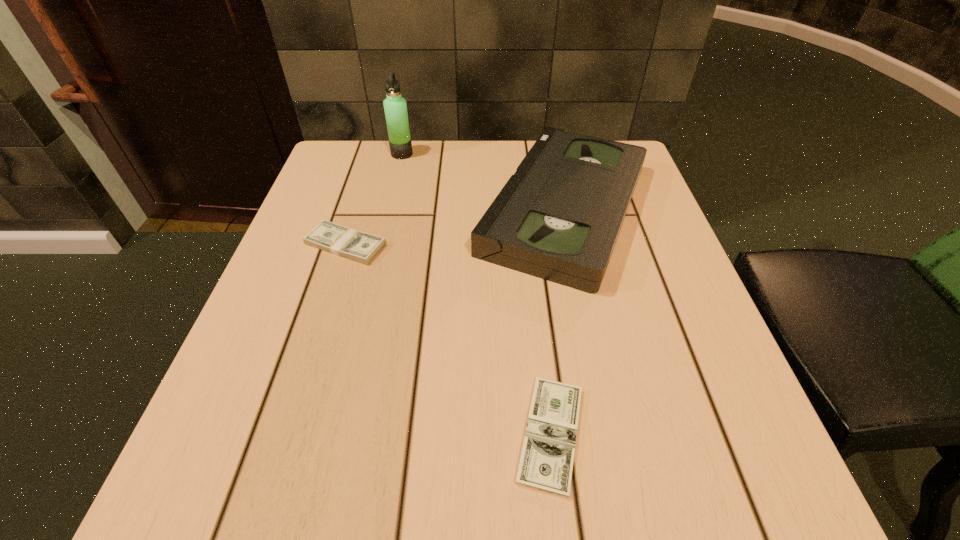
The width and height of the screenshot is (960, 540). In order to click on free spot between the shortest object and the thermos bottle in this screenshot , I will do `click(476, 294)`.

The width and height of the screenshot is (960, 540). In order to click on object that is the third closest to the left dollar in this screenshot , I will do `click(546, 463)`.

Point out which object is positioned as the third nearest to the left dollar. Please provide its 2D coordinates. Your answer should be formatted as a tuple, i.e. [(x, y)], where the tuple contains the x and y coordinates of a point satisfying the conditions above.

[(546, 463)]